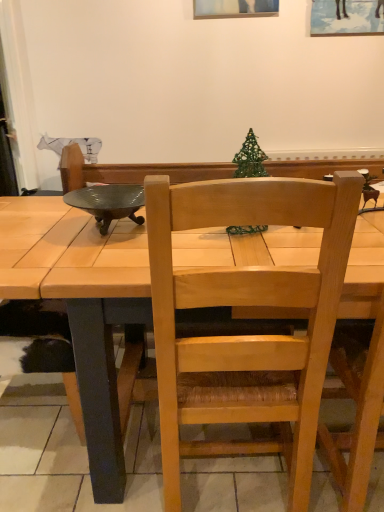
At what (x,y) coordinates should I click in order to perform the action: click on blank space to the left of metallic green bowl at upper left. Please return your answer as a coordinate pair (x, y). Looking at the image, I should click on (36, 226).